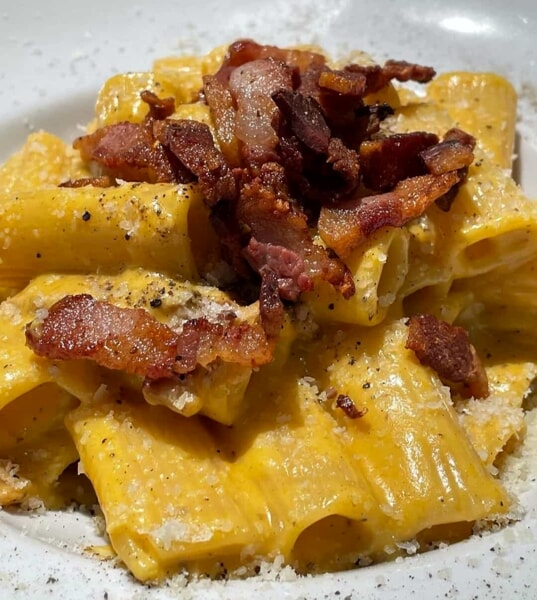
Where is `one plate`? The height and width of the screenshot is (600, 537). one plate is located at coordinates (71, 585).